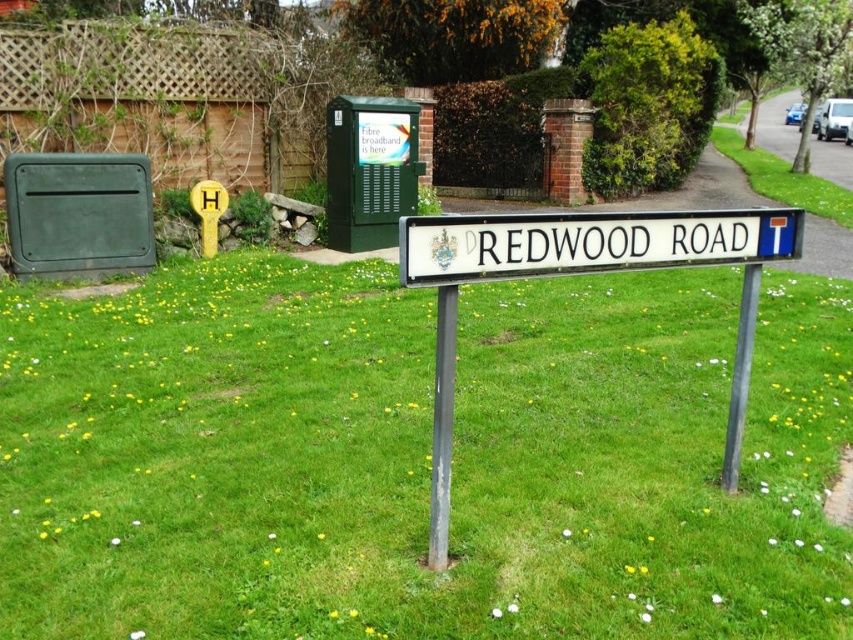
Does white plastic sign at center have a smaller size compared to black metal pole at center?

No, white plastic sign at center is not smaller than black metal pole at center.

How much distance is there between white plastic sign at center and black metal pole at center?

white plastic sign at center and black metal pole at center are 29.98 inches apart.

Is point (584, 244) farther from viewer compared to point (746, 278)?

No, it is in front of (746, 278).

The image size is (853, 640). What are the coordinates of `white plastic sign at center` in the screenshot? It's located at (589, 243).

Describe the element at coordinates (589, 243) in the screenshot. The width and height of the screenshot is (853, 640). I see `white plastic sign at center` at that location.

Is white plastic sign at center shorter than metallic pole at center?

Correct, white plastic sign at center is not as tall as metallic pole at center.

Describe the element at coordinates (589, 243) in the screenshot. I see `white plastic sign at center` at that location.

The image size is (853, 640). I want to click on white plastic sign at center, so click(x=589, y=243).

Is white plastic street sign at center bigger than metallic pole at center?

Correct, white plastic street sign at center is larger in size than metallic pole at center.

Is point (785, 241) more distant than point (450, 387)?

Yes, it is behind point (450, 387).

Does point (665, 252) come closer to viewer compared to point (442, 428)?

No, (665, 252) is further to viewer.

The image size is (853, 640). What are the coordinates of `white plastic street sign at center` in the screenshot? It's located at (581, 273).